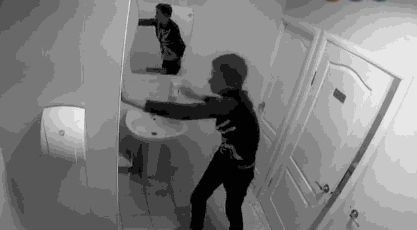
This screenshot has height=230, width=417. What are the coordinates of `soap dispenser` in the screenshot? It's located at (176, 82).